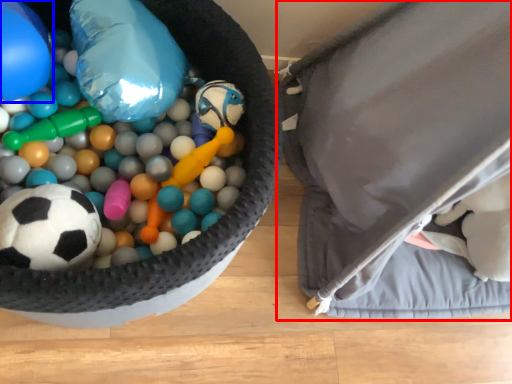
Question: Which of the following is the closest to the observer, bean bag chair (highlighted by a red box) or balloon (highlighted by a blue box)?

Choices:
 (A) bean bag chair
 (B) balloon

Answer: (A)